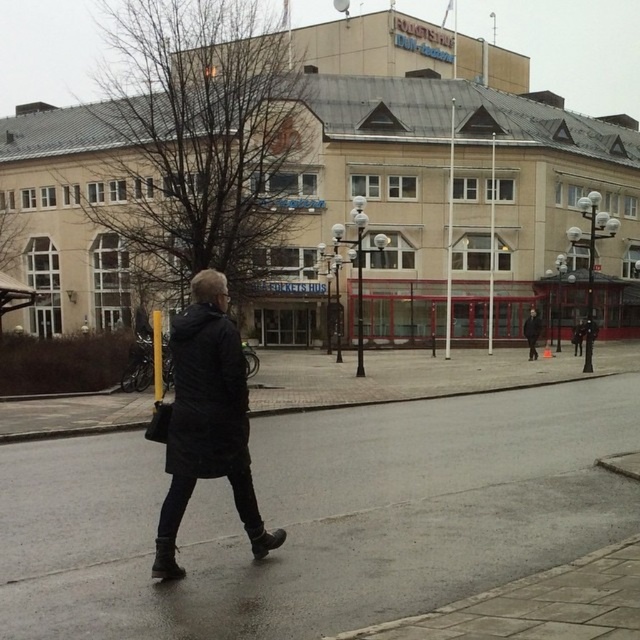
Question: Which point appears farthest from the camera in this image?

Choices:
 (A) (536, 316)
 (B) (632, 433)

Answer: (A)

Question: Is dark gray asphalt at center wider than black matte jacket at center?

Choices:
 (A) no
 (B) yes

Answer: (B)

Question: Which point is farther from the camera taking this photo?

Choices:
 (A) click(x=196, y=388)
 (B) click(x=12, y=563)
 (C) click(x=525, y=328)

Answer: (C)

Question: Does dark gray asphalt at center appear under black matte jacket at center?

Choices:
 (A) yes
 (B) no

Answer: (A)

Question: Considering the relative positions of dark gray asphalt at center and black matte coat at center in the image provided, where is dark gray asphalt at center located with respect to black matte coat at center?

Choices:
 (A) right
 (B) left

Answer: (A)

Question: Which of the following is the farthest from the observer?

Choices:
 (A) dark gray asphalt at center
 (B) black matte coat at center
 (C) black matte jacket at center

Answer: (C)